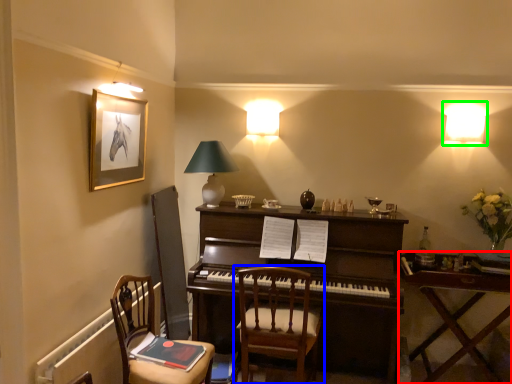
Question: Which object is positioned farthest from table (highlighted by a red box)? Select from chair (highlighted by a blue box) and lamp (highlighted by a green box).

Choices:
 (A) chair
 (B) lamp

Answer: (B)